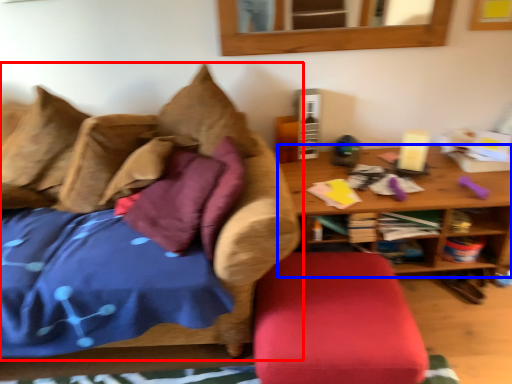
Question: Which of the following is the closest to the observer, studio couch (highlighted by a red box) or table (highlighted by a blue box)?

Choices:
 (A) studio couch
 (B) table

Answer: (A)